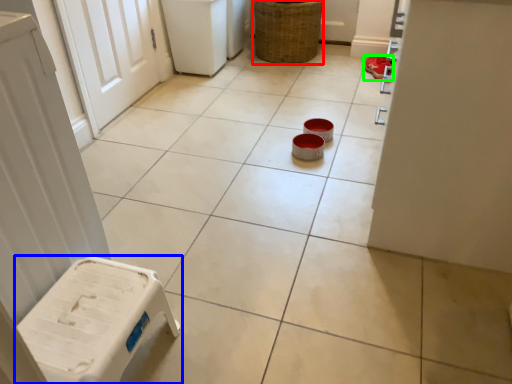
Question: Based on their relative distances, which object is nearer to basket (highlighted by a red box)? Choose from furniture (highlighted by a blue box) and footwear (highlighted by a green box).

Choices:
 (A) furniture
 (B) footwear

Answer: (B)